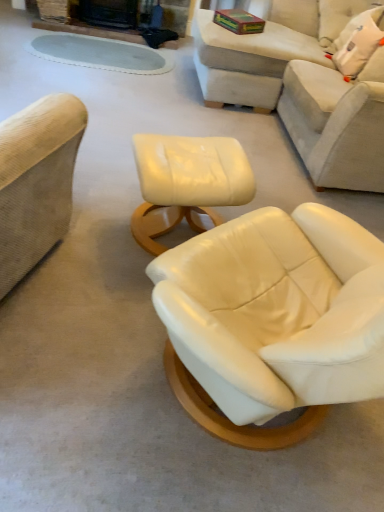
The height and width of the screenshot is (512, 384). What do you see at coordinates (304, 83) in the screenshot?
I see `beige leather couch at upper right` at bounding box center [304, 83].

What do you see at coordinates (358, 49) in the screenshot? I see `white fabric pillow at upper right` at bounding box center [358, 49].

Identify the location of beige leather couch at upper right. (335, 125).

From the image's perspective, between beige leather couch at upper right and matte cream ottoman at center, who is located below?

matte cream ottoman at center, from the image's perspective.

Is point (293, 93) closer or farther from the camera than point (201, 146)?

Point (293, 93) is farther from the camera than point (201, 146).

Who is taller, beige leather couch at upper right or matte cream ottoman at center?

Standing taller between the two is beige leather couch at upper right.

Could you tell me if beige leather couch at upper right is turned towards matte cream ottoman at center?

No.

Based on the photo, are beige leather couch at upper right and beige leather couch at upper right far apart?

No.

Which of these two, beige leather couch at upper right or beige leather couch at upper right, stands shorter?

Standing shorter between the two is beige leather couch at upper right.

Considering the sizes of objects beige leather couch at upper right and beige leather couch at upper right in the image provided, who is bigger, beige leather couch at upper right or beige leather couch at upper right?

beige leather couch at upper right.

Consider the image. From a real-world perspective, relative to beige leather couch at upper right, is beige leather couch at upper right vertically above or below?

beige leather couch at upper right is situated lower than beige leather couch at upper right in the real world.

Is beige leather couch at upper right not inside beige leather couch at upper right?

Yes, beige leather couch at upper right is outside of beige leather couch at upper right.

From a real-world perspective, is beige leather couch at upper right below beige leather couch at upper right?

No, from a real-world perspective, beige leather couch at upper right is not beneath beige leather couch at upper right.

Is matte cream ottoman at center positioned in front of beige leather couch at upper right?

Yes, matte cream ottoman at center is closer to the viewer.

Can you tell me how much matte cream ottoman at center and beige leather couch at upper right differ in facing direction?

The angular difference between matte cream ottoman at center and beige leather couch at upper right is 79 degrees.

Image resolution: width=384 pixels, height=512 pixels. What are the coordinates of `studio couch above the matte cream ottoman at center (from a real-world perspective)` in the screenshot? It's located at (304, 83).

Is matte cream ottoman at center facing away from beige leather couch at upper right?

No, matte cream ottoman at center's orientation is not away from beige leather couch at upper right.

Can you tell me how much matte cream ottoman at center and beige leather couch at upper right differ in facing direction?

There is a 31.4-degree angle between the facing directions of matte cream ottoman at center and beige leather couch at upper right.

Between matte cream ottoman at center and beige leather couch at upper right, which one has larger size?

beige leather couch at upper right.

Is matte cream ottoman at center in contact with beige leather couch at upper right?

No.

Considering the positions of objects matte cream ottoman at center and beige leather couch at upper right in the image provided, who is more to the right, matte cream ottoman at center or beige leather couch at upper right?

Positioned to the right is beige leather couch at upper right.

Is white fabric pillow at upper right inside or outside of beige leather couch at upper right?

white fabric pillow at upper right lies within the bounds of beige leather couch at upper right.

Considering the relative sizes of white fabric pillow at upper right and beige leather couch at upper right in the image provided, is white fabric pillow at upper right shorter than beige leather couch at upper right?

Indeed, white fabric pillow at upper right has a lesser height compared to beige leather couch at upper right.

Is white fabric pillow at upper right touching beige leather couch at upper right?

No, white fabric pillow at upper right is not beside beige leather couch at upper right.

Which object is more forward, white fabric pillow at upper right or beige leather couch at upper right?

beige leather couch at upper right is more forward.

Based on the photo, considering the relative positions of white fabric pillow at upper right and matte cream ottoman at center in the image provided, is white fabric pillow at upper right to the left of matte cream ottoman at center from the viewer's perspective?

No.

From a real-world perspective, is white fabric pillow at upper right positioned above or below matte cream ottoman at center?

In terms of real-world spatial position, white fabric pillow at upper right is above matte cream ottoman at center.

Which object is further away from the camera, white fabric pillow at upper right or matte cream ottoman at center?

white fabric pillow at upper right is further away from the camera.

From the image's perspective, which is below, white fabric pillow at upper right or matte cream ottoman at center?

matte cream ottoman at center appears lower in the image.

In the image, there is a matte cream ottoman at center. Identify the location of couch above it (from the image's perspective). (335, 125).

Locate an element on the screen. This screenshot has height=512, width=384. studio couch in front of the beige leather couch at upper right is located at coordinates (304, 83).

From the image, which object appears to be nearer to white fabric pillow at upper right, beige leather couch at upper right or beige leather couch at upper right?

beige leather couch at upper right is closer to white fabric pillow at upper right.

Based on their spatial positions, is white fabric pillow at upper right or beige leather couch at upper right closer to matte cream ottoman at center?

beige leather couch at upper right is positioned closer to the anchor matte cream ottoman at center.

When comparing their distances from beige leather couch at upper right, does beige leather couch at upper right or white fabric pillow at upper right seem closer?

beige leather couch at upper right is positioned closer to the anchor beige leather couch at upper right.

From the image, which object appears to be farther from white fabric pillow at upper right, beige leather couch at upper right or beige leather couch at upper right?

beige leather couch at upper right is further to white fabric pillow at upper right.

Based on their spatial positions, is white fabric pillow at upper right or beige leather couch at upper right closer to matte cream ottoman at center?

beige leather couch at upper right is positioned closer to the anchor matte cream ottoman at center.

Looking at the image, which one is located closer to white fabric pillow at upper right, beige leather couch at upper right or matte cream ottoman at center?

beige leather couch at upper right is closer to white fabric pillow at upper right.

From the image, which object appears to be nearer to white fabric pillow at upper right, matte cream ottoman at center or beige leather couch at upper right?

The object closer to white fabric pillow at upper right is beige leather couch at upper right.

Based on their spatial positions, is white fabric pillow at upper right or matte cream ottoman at center closer to beige leather couch at upper right?

white fabric pillow at upper right is positioned closer to the anchor beige leather couch at upper right.

I want to click on studio couch between matte cream ottoman at center and white fabric pillow at upper right from left to right, so click(304, 83).

This screenshot has width=384, height=512. I want to click on couch located between matte cream ottoman at center and white fabric pillow at upper right in the left-right direction, so click(335, 125).

Locate an element on the screen. The width and height of the screenshot is (384, 512). couch located between beige leather couch at upper right and white fabric pillow at upper right in the depth direction is located at coordinates (335, 125).

This screenshot has height=512, width=384. I want to click on studio couch between matte cream ottoman at center and beige leather couch at upper right in the horizontal direction, so click(304, 83).